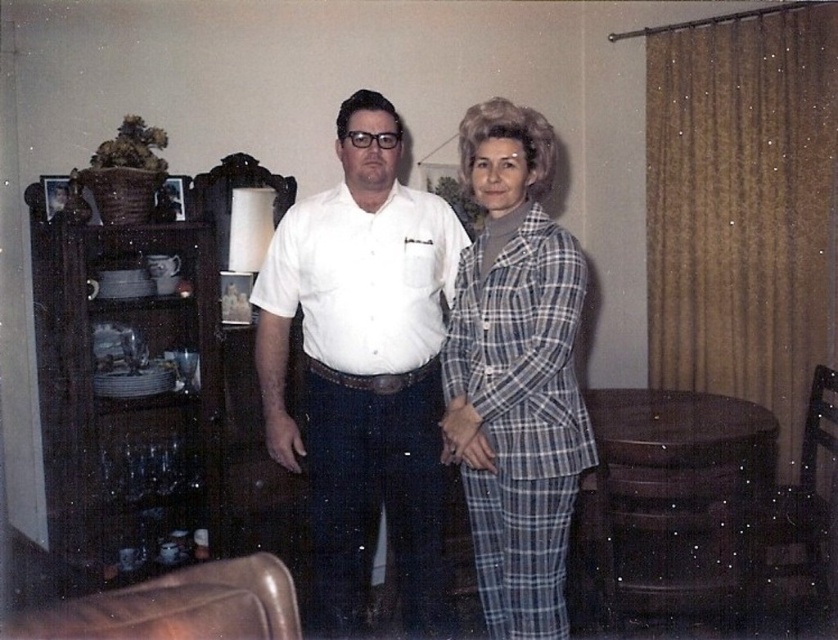
Measure the distance between white cotton shirt at center and camera.

The distance of white cotton shirt at center from camera is 2.15 meters.

Is point (357, 384) positioned in front of point (578, 452)?

No, it is behind (578, 452).

This screenshot has width=838, height=640. In order to click on white cotton shirt at center in this screenshot , I will do `click(363, 368)`.